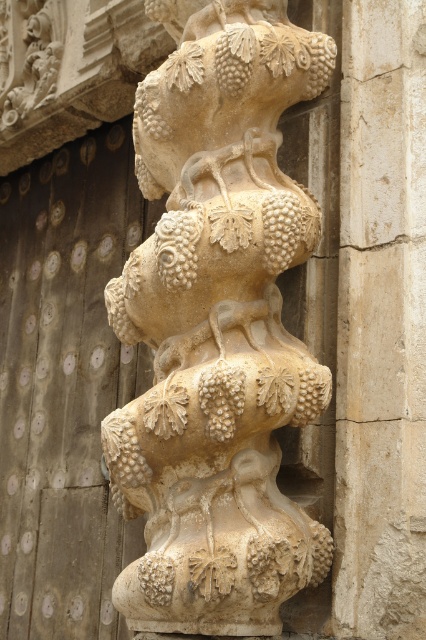
Question: Among these points, which one is nearest to the camera?

Choices:
 (A) [400, 467]
 (B) [310, 392]

Answer: (B)

Question: Which object is farther from the camera taking this photo?

Choices:
 (A) beige stone grapes at center
 (B) beige stone column at center

Answer: (B)

Question: Does beige stone grapes at center lie behind beige stone column at center?

Choices:
 (A) yes
 (B) no

Answer: (B)

Question: Does beige stone grapes at center lie behind beige stone column at center?

Choices:
 (A) no
 (B) yes

Answer: (A)

Question: Is beige stone grapes at center to the right of beige stone column at center from the viewer's perspective?

Choices:
 (A) yes
 (B) no

Answer: (B)